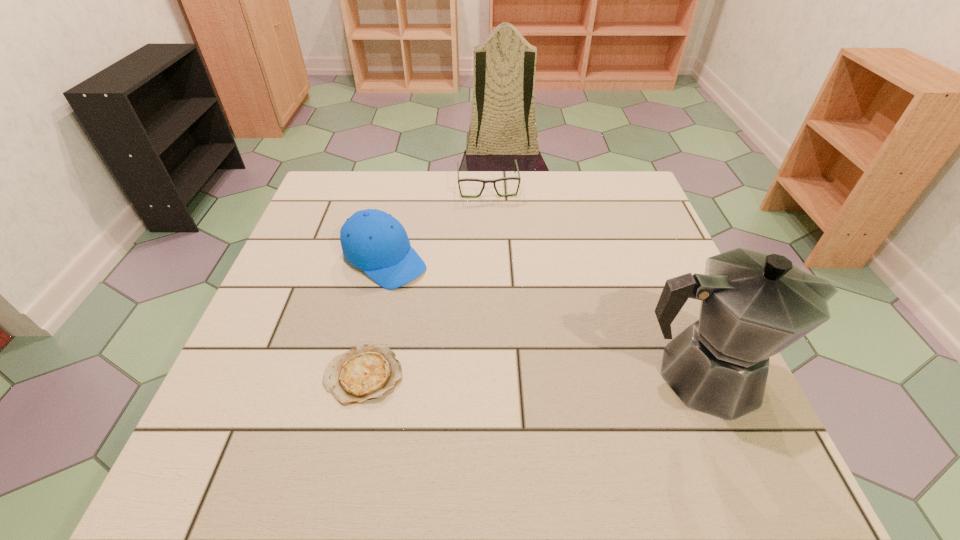
You are a GUI agent. You are given a task and a screenshot of the screen. Output one action in this format:
    pyautogui.click(x=<x>, y=<y>)
    Task: Click on the shortest object
    
    Given the screenshot: What is the action you would take?
    coord(365,372)

Where is `the tallest object`? The image size is (960, 540). the tallest object is located at coordinates pyautogui.click(x=754, y=305).

This screenshot has width=960, height=540. I want to click on the rightmost object, so click(x=754, y=305).

You are a GUI agent. You are given a task and a screenshot of the screen. Output one action in this format:
    pyautogui.click(x=<x>, y=<y>)
    Task: Click on the cap
    This screenshot has height=540, width=960.
    Given the screenshot: What is the action you would take?
    pyautogui.click(x=372, y=240)

At what (x,y) coordinates should I click in order to perform the action: click on the second tallest object. Please return your answer as a coordinate pair (x, y). This screenshot has width=960, height=540. Looking at the image, I should click on (372, 240).

Where is `the second object from right to left`? The width and height of the screenshot is (960, 540). the second object from right to left is located at coordinates (494, 181).

Identify the location of spectacles. This screenshot has height=540, width=960. (494, 181).

Find the location of `blank area located 0.240m on the back of the shortest object`. blank area located 0.240m on the back of the shortest object is located at coordinates (388, 266).

Locate an element on the screen. The width and height of the screenshot is (960, 540). vacant space located on the front-facing side of the third nearest object is located at coordinates (504, 359).

Identify the location of vacant point located 0.060m on the front-facing side of the third nearest object. (427, 295).